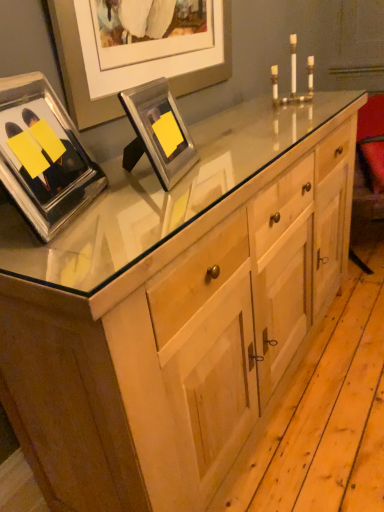
The image size is (384, 512). I want to click on free space in front of clear glass picture frame at upper left, which is the 1th picture frame from left to right, so click(76, 259).